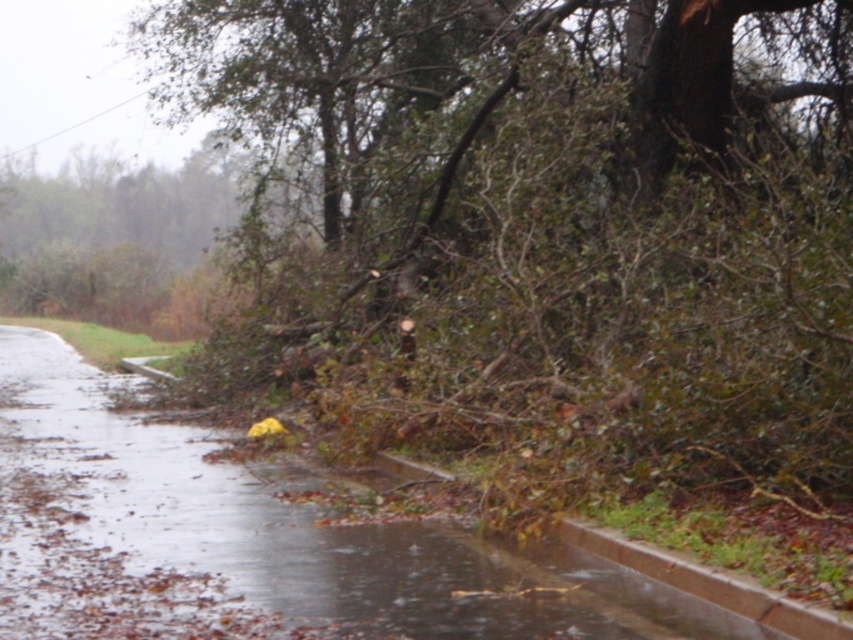
Which is in front, point (654, 452) or point (177, 472)?

Point (654, 452) is in front.

Who is taller, brown rough tree at center or wet concrete flood at lower left?

brown rough tree at center is taller.

Is point (648, 44) positioned behind point (428, 618)?

Yes, point (648, 44) is farther from viewer.

I want to click on brown rough tree at center, so click(548, 228).

Can you confirm if wet concrete flood at lower left is shorter than brown concrete curb at lower right?

No, wet concrete flood at lower left is not shorter than brown concrete curb at lower right.

Is wet concrete flood at lower left positioned in front of brown concrete curb at lower right?

Yes, it is in front of brown concrete curb at lower right.

The image size is (853, 640). Describe the element at coordinates (320, 531) in the screenshot. I see `wet concrete flood at lower left` at that location.

The height and width of the screenshot is (640, 853). Identify the location of wet concrete flood at lower left. (320, 531).

Can you confirm if brown rough tree at center is positioned to the left of brown concrete curb at lower right?

No, brown rough tree at center is not to the left of brown concrete curb at lower right.

Who is positioned more to the right, brown rough tree at center or brown concrete curb at lower right?

brown rough tree at center

Between point (846, 33) and point (584, 532), which one is positioned behind?

Point (846, 33)

At what (x,y) coordinates should I click in order to perform the action: click on brown rough tree at center. Please return your answer as a coordinate pair (x, y). Looking at the image, I should click on (548, 228).